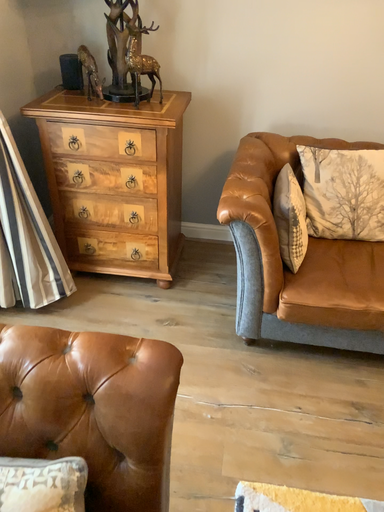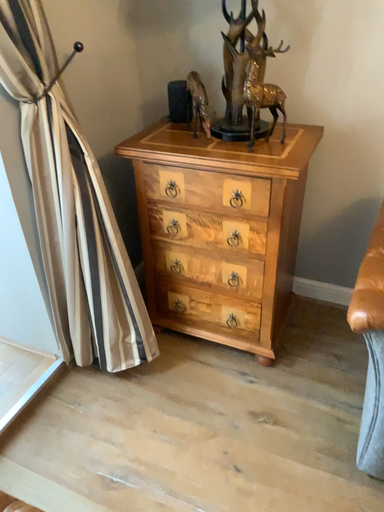
Question: How did the camera likely rotate when shooting the video?

Choices:
 (A) rotated right
 (B) rotated left

Answer: (B)